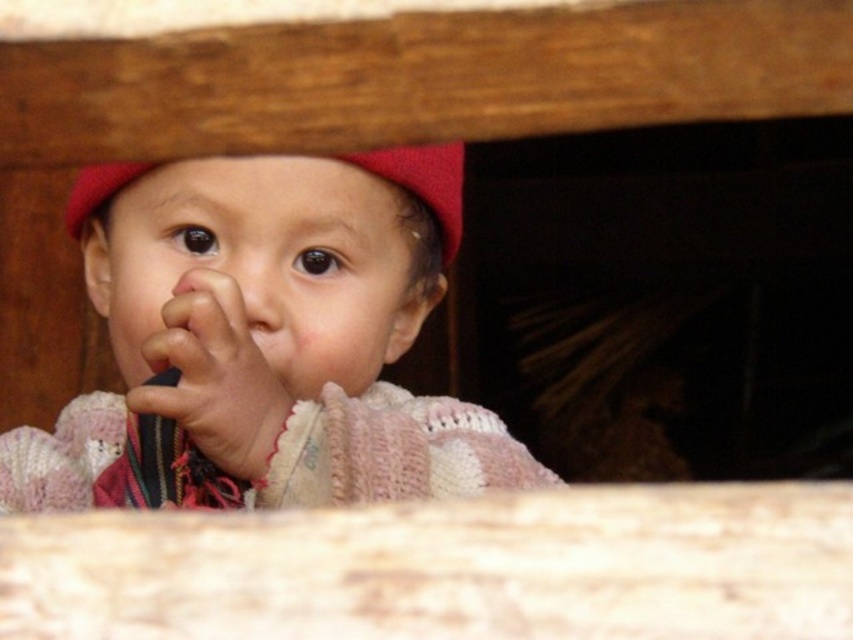
Question: From the image, what is the correct spatial relationship of red knitted hat at center in relation to smooth flesh nose at center?

Choices:
 (A) above
 (B) below

Answer: (A)

Question: Which object is the farthest from the soft pink fabric hand at center?

Choices:
 (A) knitted pink sweater at center
 (B) smooth flesh nose at center
 (C) red knitted hat at center

Answer: (C)

Question: Estimate the real-world distances between objects in this image. Which object is farther from the soft pink fabric hand at center?

Choices:
 (A) red knitted hat at center
 (B) knitted pink sweater at center
 (C) smooth flesh nose at center

Answer: (A)

Question: Among these points, which one is farthest from the camera?

Choices:
 (A) (454, 196)
 (B) (173, 330)
 (C) (247, 285)

Answer: (A)

Question: Does knitted pink sweater at center have a lesser width compared to red knitted hat at center?

Choices:
 (A) no
 (B) yes

Answer: (A)

Question: Does red knitted hat at center appear over smooth flesh nose at center?

Choices:
 (A) yes
 (B) no

Answer: (A)